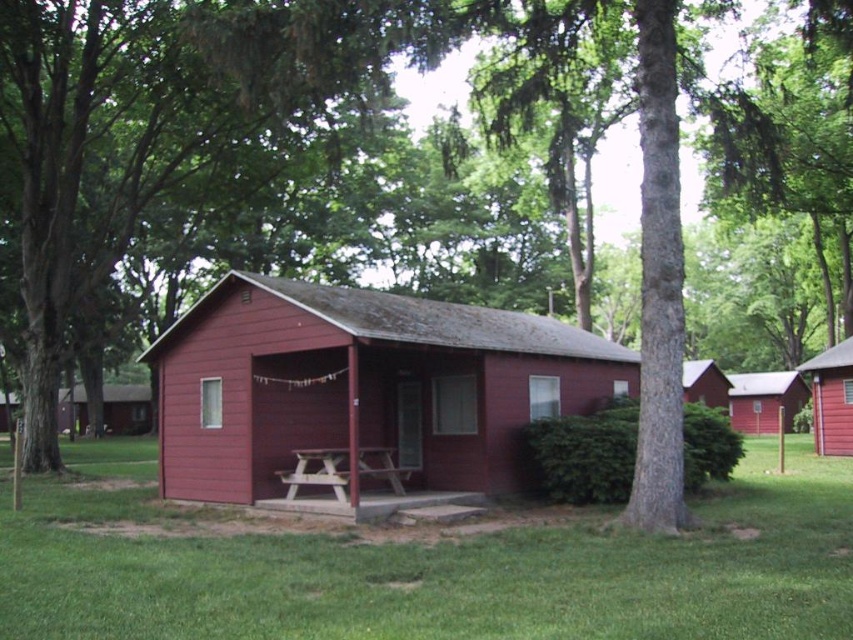
You are standing in front of the cabin and want to know which of the two points, point (833, 628) or point (508, 340), is closer to you. Which one is closer?

Point (833, 628) is closer to the camera than point (508, 340), so it is closer to you.

You are standing in front of the red cabin and want to place a 15 feet long banner between the camera and the green grass at lower center. Will the banner fit without overlapping the grass?

The green grass at lower center is 18.03 feet from the camera. Since the banner is 15 feet long, it will fit between the camera and the grass without overlapping.